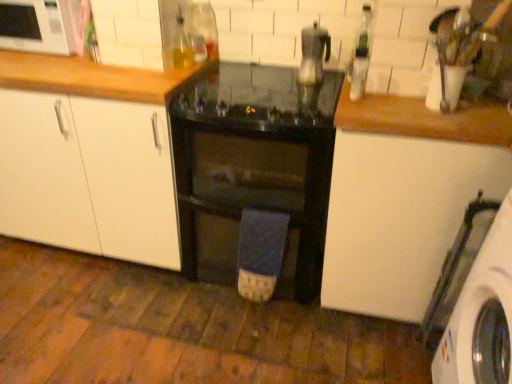
Where is `free space in front of white matte cabinet at upper center, positioned as the second cabinetry in left-to-right order`? free space in front of white matte cabinet at upper center, positioned as the second cabinetry in left-to-right order is located at coordinates (116, 74).